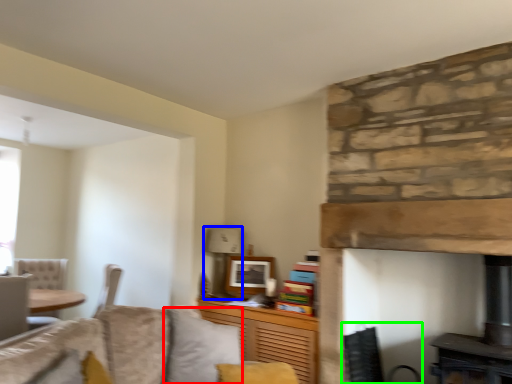
Question: Considering the real-world distances, which object is closest to pillow (highlighted by a red box)? lamp (highlighted by a blue box) or swivel chair (highlighted by a green box).

Choices:
 (A) lamp
 (B) swivel chair

Answer: (B)